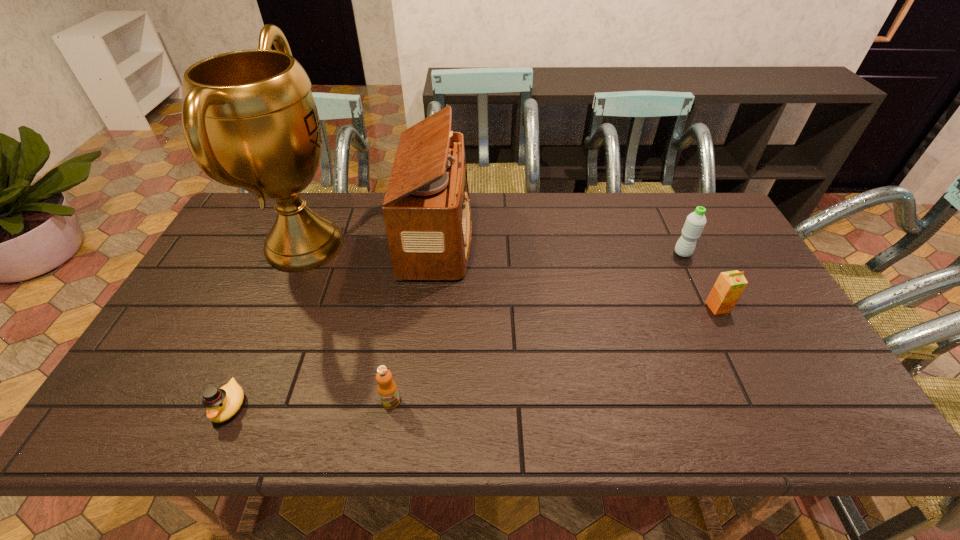
This screenshot has width=960, height=540. I want to click on the tallest object, so click(250, 120).

Identify the location of radio receiver. (426, 209).

Locate an element on the screen. the third tallest object is located at coordinates (695, 222).

Where is `the right orange juice`? This screenshot has width=960, height=540. the right orange juice is located at coordinates (729, 286).

Locate an element on the screen. Image resolution: width=960 pixels, height=540 pixels. the left orange juice is located at coordinates (387, 389).

Find the location of a particular element. duck is located at coordinates (221, 404).

Identify the location of free space located 0.320m on the surface of the trophy cup with symbols. Image resolution: width=960 pixels, height=540 pixels. (452, 246).

Where is `blank space located on the front panel of the second tallest object`? This screenshot has height=540, width=960. blank space located on the front panel of the second tallest object is located at coordinates [488, 237].

Where is `vacant region located 0.140m on the left of the fourth shortest object`? The width and height of the screenshot is (960, 540). vacant region located 0.140m on the left of the fourth shortest object is located at coordinates (628, 253).

Where is `free space located on the left of the farther orange juice`? free space located on the left of the farther orange juice is located at coordinates (623, 307).